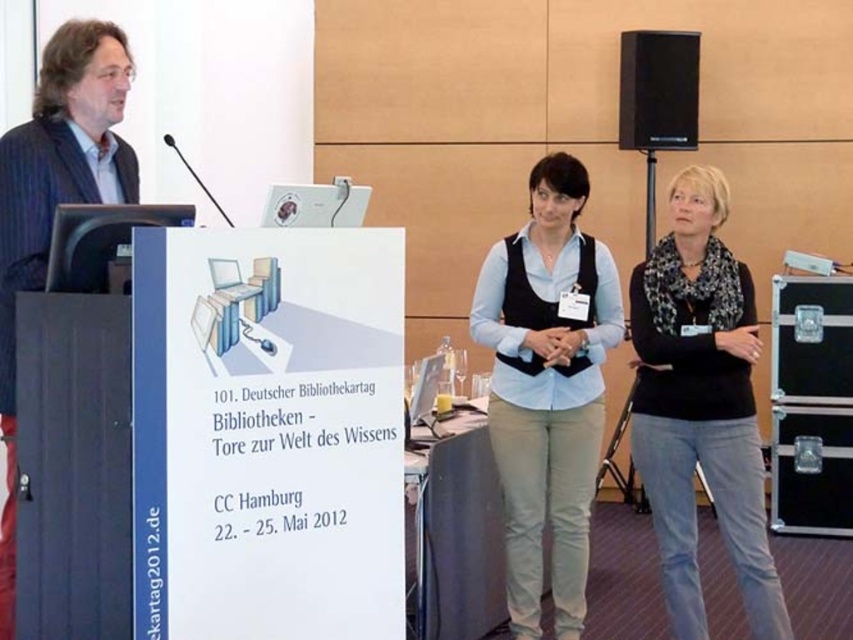
Is black knitwear at right above dark blue suit at left?

No.

Who is positioned more to the right, black knitwear at right or dark blue suit at left?

From the viewer's perspective, black knitwear at right appears more on the right side.

What do you see at coordinates (700, 406) in the screenshot? I see `black knitwear at right` at bounding box center [700, 406].

Find the location of a particular element. black knitwear at right is located at coordinates (700, 406).

Does light blue cotton shirt at center appear on the right side of black matte speaker at upper right?

Incorrect, light blue cotton shirt at center is not on the right side of black matte speaker at upper right.

Is point (535, 624) positioned behind point (647, 32)?

No, (535, 624) is in front of (647, 32).

Which is behind, point (547, 179) or point (663, 90)?

Point (663, 90)

Locate an element on the screen. light blue cotton shirt at center is located at coordinates (547, 387).

Does black knitwear at right have a greater width compared to black matte speaker at upper right?

Yes.

This screenshot has width=853, height=640. What do you see at coordinates (700, 406) in the screenshot? I see `black knitwear at right` at bounding box center [700, 406].

Find the location of `black knitwear at right`. black knitwear at right is located at coordinates (700, 406).